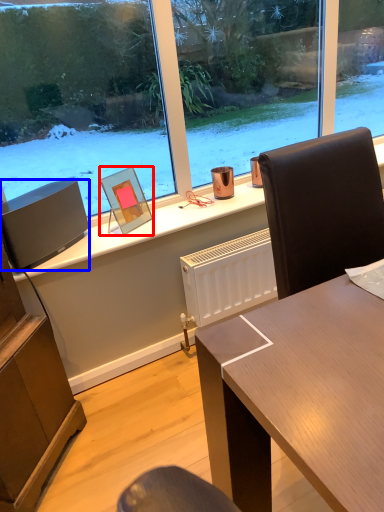
Question: Which object is closer to the camera taking this photo, picture frame (highlighted by a red box) or loudspeaker (highlighted by a blue box)?

Choices:
 (A) picture frame
 (B) loudspeaker

Answer: (B)